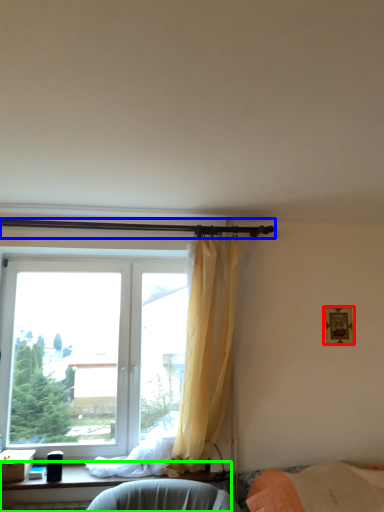
Question: Based on their relative distances, which object is farther from picture frame (highlighted by a red box)? Choose from beam (highlighted by a blue box) and furniture (highlighted by a green box).

Choices:
 (A) beam
 (B) furniture

Answer: (B)